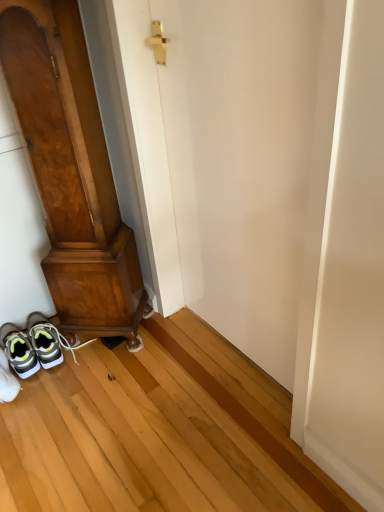
Where is `free space in front of white smooth door at center, which ranks as the 2th door in left-to-right order`? The height and width of the screenshot is (512, 384). free space in front of white smooth door at center, which ranks as the 2th door in left-to-right order is located at coordinates (218, 446).